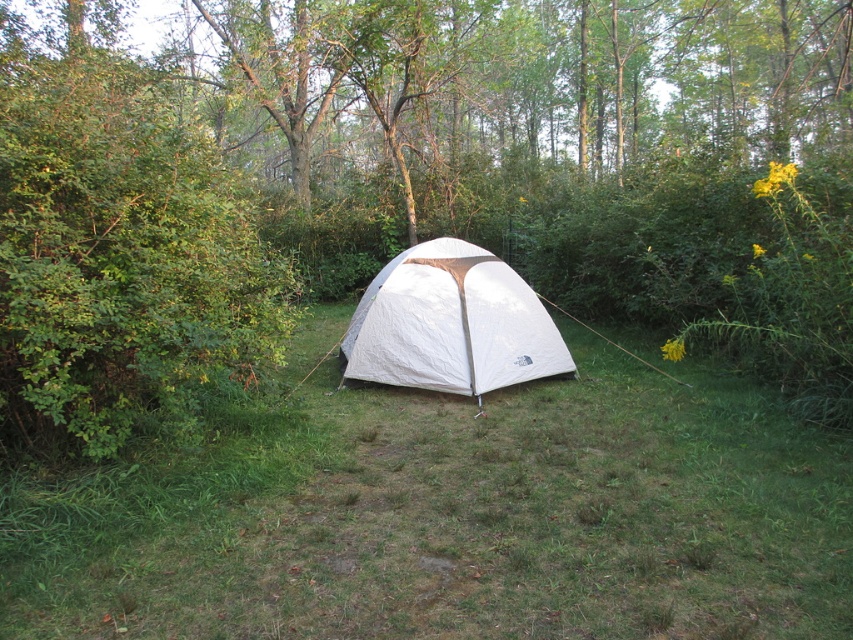
Does green grassy at center have a greater width compared to white fabric tent at center?

Correct, the width of green grassy at center exceeds that of white fabric tent at center.

Who is positioned more to the right, green grassy at center or white fabric tent at center?

green grassy at center is more to the right.

Between point (105, 634) and point (361, 298), which one is positioned behind?

Positioned behind is point (361, 298).

At what (x,y) coordinates should I click in order to perform the action: click on green grassy at center. Please return your answer as a coordinate pair (x, y). Looking at the image, I should click on (451, 516).